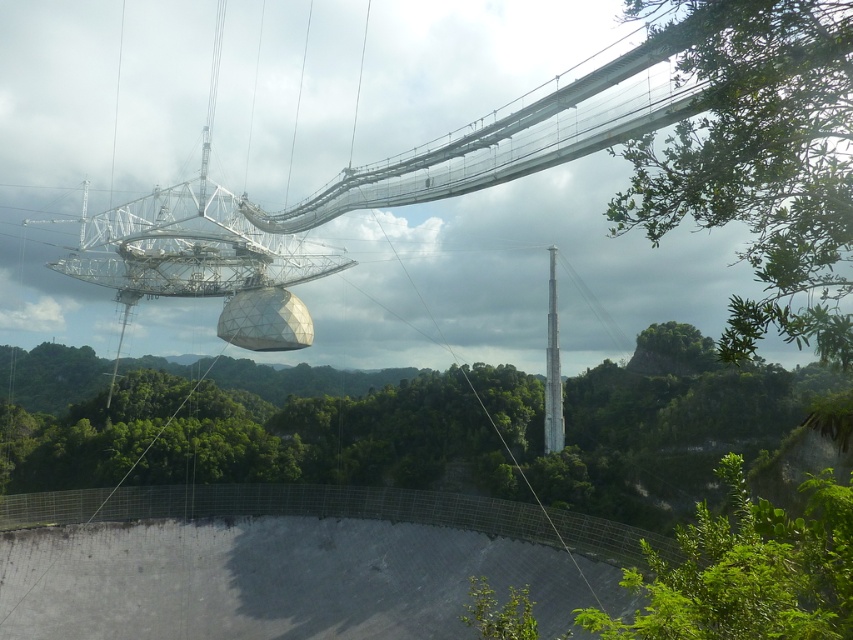
You are standing at the base of the radio telescope and want to take a photo of the green leafy tree at center. Which direction should you face to capture the tree in your view?

The green leafy tree at center is located at point coordinates, so you should face towards the center of the image to capture it in your view.

You are a visitor at the radio telescope site and want to take a photo of the smooth gray pole at center without any obstructions. However, there is a green leafy tree at lower right in the way. Can you move to a position where the tree is no longer blocking your view of the pole?

The green leafy tree at lower right is below the smooth gray pole at center, so if you move to a position where you are looking upwards, the tree will be out of the way and you can see the smooth gray pole at center clearly.

You are standing at the center of the image looking at the radio telescope. Can you see the green leafy tree at lower right from your current position?

The green leafy tree at lower right is located at point (x=747, y=572), which is in the lower right area of the image. Since you are at the center, you can see the green leafy tree at lower right in your field of view.